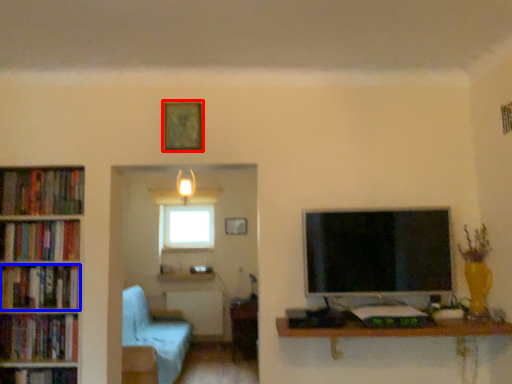
Question: Among these objects, which one is nearest to the camera, picture frame (highlighted by a red box) or book (highlighted by a blue box)?

Choices:
 (A) picture frame
 (B) book

Answer: (A)